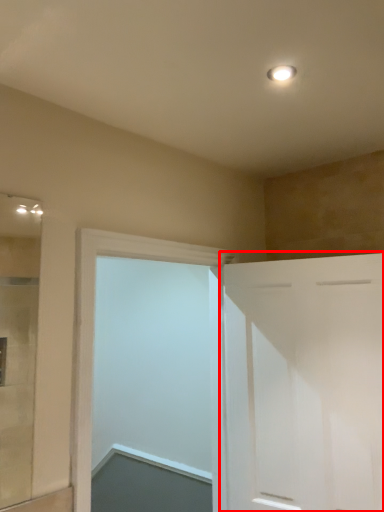
Question: In this image, where is door (annotated by the red box) located relative to door?

Choices:
 (A) right
 (B) left

Answer: (A)